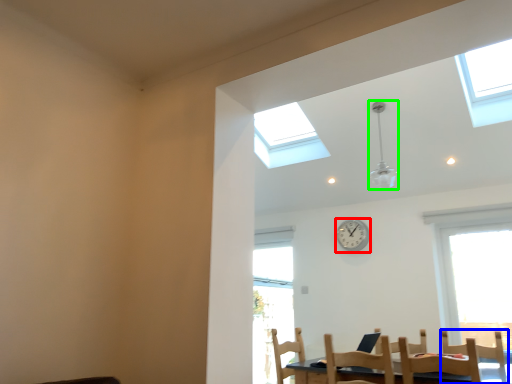
Question: Which is farther away from clock (highlighted by a red box)? chair (highlighted by a blue box) or light fixture (highlighted by a green box)?

Choices:
 (A) chair
 (B) light fixture

Answer: (A)